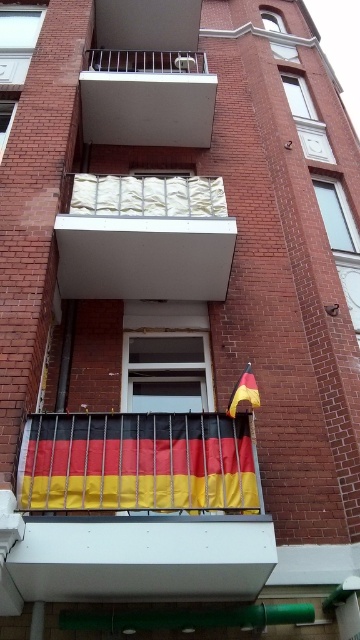
In the scene shown: You are standing in front of the brick building and notice two windows, the white glass window at upper left and the clear glass window at upper center. Which window appears closer to you?

The white glass window at upper left appears closer because it is in front of the clear glass window at upper center.

You are standing 20 feet away from the building. Can you reach the smooth white balcony at upper center with a 5 foot long pole?

The smooth white balcony at upper center is 23.94 feet away from the camera. Since you are standing 20 feet away, the total distance to the balcony would be 20 feet plus the distance between you and the camera. Without knowing the exact position of the camera, it is impossible to determine if the 5 foot pole would be sufficient.

You are standing in front of the brick building and want to place a new flowerpot on the smooth white balcony at upper center. However, there is a clear glass window at upper center nearby. Can you place the flowerpot on the balcony without blocking the window?

The smooth white balcony at upper center is closer to the viewer than the clear glass window at upper center, so placing the flowerpot on the balcony would not block the window since the balcony is in front of the window.